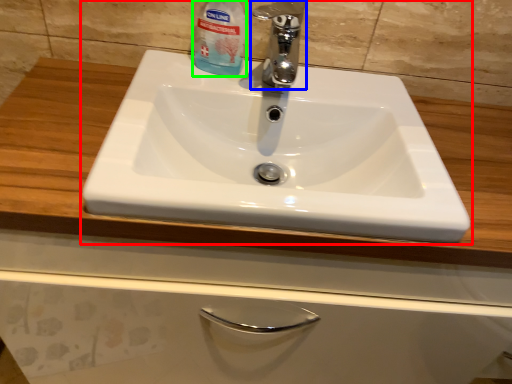
Question: Based on their relative distances, which object is nearer to sink (highlighted by a red box)? Choose from tap (highlighted by a blue box) and cleaning product (highlighted by a green box).

Choices:
 (A) tap
 (B) cleaning product

Answer: (A)